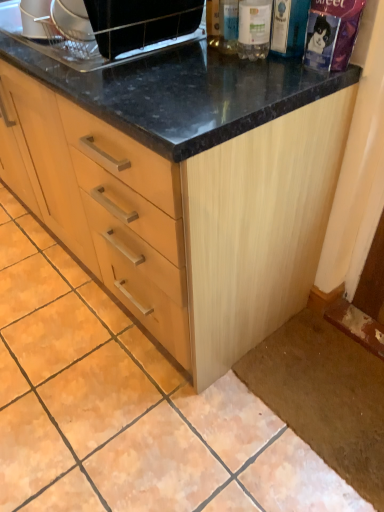
Locate an element on the screen. The width and height of the screenshot is (384, 512). vacant area that lies in front of clear glass bottle at upper center, the 1th bottle from the left is located at coordinates (216, 67).